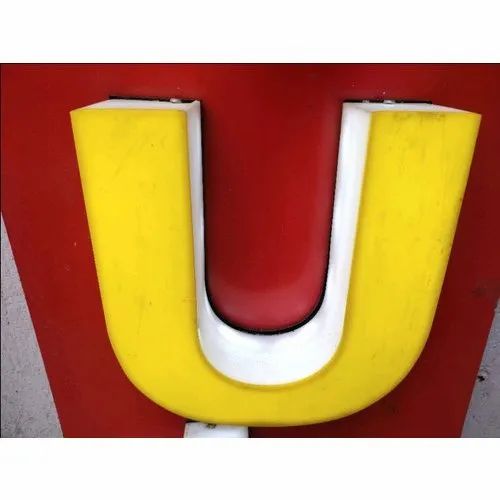
The image size is (500, 500). I want to click on yellow paint, so click(387, 312).